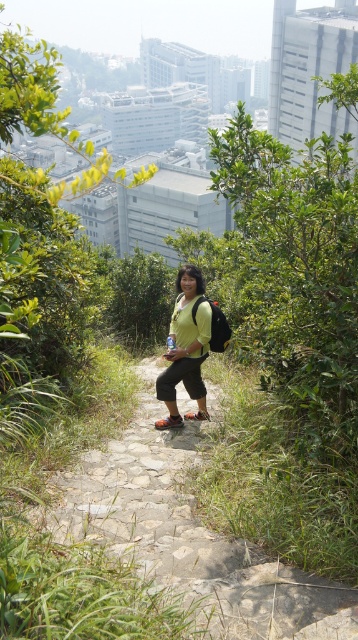
Question: Can you confirm if stone path at center is thinner than matte green shirt at center?

Choices:
 (A) yes
 (B) no

Answer: (A)

Question: Does stone path at center have a smaller size compared to matte green shirt at center?

Choices:
 (A) yes
 (B) no

Answer: (A)

Question: Among these points, which one is nearest to the camera?

Choices:
 (A) coord(197,593)
 (B) coord(184,337)

Answer: (A)

Question: Is stone path at center thinner than matte green shirt at center?

Choices:
 (A) yes
 (B) no

Answer: (A)

Question: Which object is farther from the camera taking this photo?

Choices:
 (A) matte green shirt at center
 (B) stone path at center

Answer: (A)